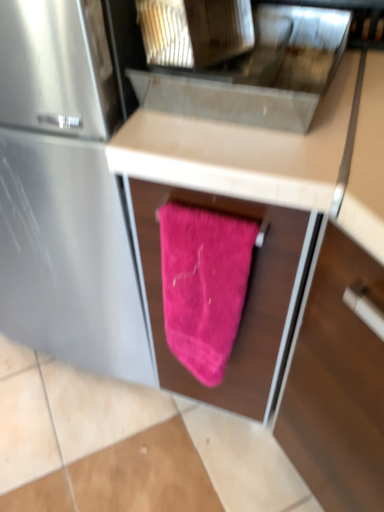
The width and height of the screenshot is (384, 512). What do you see at coordinates (243, 152) in the screenshot? I see `pink fabric at center` at bounding box center [243, 152].

Describe the element at coordinates (203, 285) in the screenshot. The height and width of the screenshot is (512, 384). I see `pink fuzzy towel at center` at that location.

I want to click on pink fabric at center, so click(x=243, y=152).

Considering the relative positions of pink fabric at center and pink fuzzy towel at center in the image provided, is pink fabric at center to the left of pink fuzzy towel at center from the viewer's perspective?

No.

From the image's perspective, which object appears higher, pink fabric at center or pink fuzzy towel at center?

From the image's view, pink fabric at center is above.

Is pink fabric at center facing away from pink fuzzy towel at center?

That's not correct — pink fabric at center is not looking away from pink fuzzy towel at center.

Image resolution: width=384 pixels, height=512 pixels. Identify the location of cabinetry on the right of pink fuzzy towel at center. (243, 152).

From a real-world perspective, is pink fuzzy towel at center positioned above or below metallic stainless steel sink at upper center?

In terms of real-world spatial position, pink fuzzy towel at center is below metallic stainless steel sink at upper center.

Can we say pink fuzzy towel at center lies outside metallic stainless steel sink at upper center?

That's correct, pink fuzzy towel at center is outside of metallic stainless steel sink at upper center.

Which object is more forward, pink fuzzy towel at center or metallic stainless steel sink at upper center?

metallic stainless steel sink at upper center is more forward.

Considering the sizes of pink fuzzy towel at center and metallic stainless steel sink at upper center in the image, is pink fuzzy towel at center bigger or smaller than metallic stainless steel sink at upper center?

Clearly, pink fuzzy towel at center is smaller in size than metallic stainless steel sink at upper center.

Is metallic stainless steel sink at upper center at the right side of pink fabric at center?

In fact, metallic stainless steel sink at upper center is to the left of pink fabric at center.

Considering the sizes of objects metallic stainless steel sink at upper center and pink fabric at center in the image provided, who is shorter, metallic stainless steel sink at upper center or pink fabric at center?

Standing shorter between the two is metallic stainless steel sink at upper center.

Looking at the image, does metallic stainless steel sink at upper center seem bigger or smaller compared to pink fabric at center?

Considering their sizes, metallic stainless steel sink at upper center takes up less space than pink fabric at center.

Would you consider metallic stainless steel sink at upper center to be distant from pink fabric at center?

Actually, metallic stainless steel sink at upper center and pink fabric at center are a little close together.

From the image's perspective, relative to pink fuzzy towel at center, is metallic stainless steel sink at upper center above or below?

Based on their image positions, metallic stainless steel sink at upper center is located above pink fuzzy towel at center.

Is point (261, 102) behind point (242, 228)?

No, (261, 102) is closer to viewer.

From the image's perspective, is pink fuzzy towel at center positioned above or below pink fabric at center?

Clearly, from the image's perspective, pink fuzzy towel at center is below pink fabric at center.

Can you confirm if pink fuzzy towel at center is thinner than pink fabric at center?

Correct, the width of pink fuzzy towel at center is less than that of pink fabric at center.

Identify the location of beach towel behind the pink fabric at center. The height and width of the screenshot is (512, 384). pyautogui.click(x=203, y=285).

Considering the sizes of pink fabric at center and metallic stainless steel sink at upper center in the image, is pink fabric at center wider or thinner than metallic stainless steel sink at upper center?

pink fabric at center is wider than metallic stainless steel sink at upper center.

In the scene shown: From the image's perspective, who appears lower, pink fabric at center or metallic stainless steel sink at upper center?

pink fabric at center.

Is the position of pink fabric at center less distant than that of metallic stainless steel sink at upper center?

Yes, pink fabric at center is in front of metallic stainless steel sink at upper center.

From a real-world perspective, relative to metallic stainless steel sink at upper center, is pink fabric at center vertically above or below?

pink fabric at center is situated lower than metallic stainless steel sink at upper center in the real world.

You are a GUI agent. You are given a task and a screenshot of the screen. Output one action in this format:
    pyautogui.click(x=<x>, y=<y>)
    Task: Click on the cabinetry below the pink fuzzy towel at center (from a real-world perspective)
    The width and height of the screenshot is (384, 512).
    Given the screenshot: What is the action you would take?
    pyautogui.click(x=243, y=152)

I want to click on sink positioned vertically above the pink fuzzy towel at center (from a real-world perspective), so click(258, 73).

From the image, which object appears to be nearer to pink fabric at center, metallic stainless steel sink at upper center or pink fuzzy towel at center?

metallic stainless steel sink at upper center is positioned closer to the anchor pink fabric at center.

From the image, which object appears to be farther from metallic stainless steel sink at upper center, pink fabric at center or pink fuzzy towel at center?

pink fuzzy towel at center is further to metallic stainless steel sink at upper center.

From the image, which object appears to be farther from metallic stainless steel sink at upper center, pink fuzzy towel at center or pink fabric at center?

pink fuzzy towel at center lies further to metallic stainless steel sink at upper center than the other object.

Based on the photo, from the image, which object appears to be nearer to pink fuzzy towel at center, metallic stainless steel sink at upper center or pink fabric at center?

Based on the image, pink fabric at center appears to be nearer to pink fuzzy towel at center.

When comparing their distances from pink fuzzy towel at center, does pink fabric at center or metallic stainless steel sink at upper center seem further?

metallic stainless steel sink at upper center.

Based on their spatial positions, is pink fuzzy towel at center or metallic stainless steel sink at upper center further from pink fabric at center?

pink fuzzy towel at center is positioned further to the anchor pink fabric at center.

Identify the location of cabinetry between metallic stainless steel sink at upper center and pink fuzzy towel at center in the up-down direction. (243, 152).